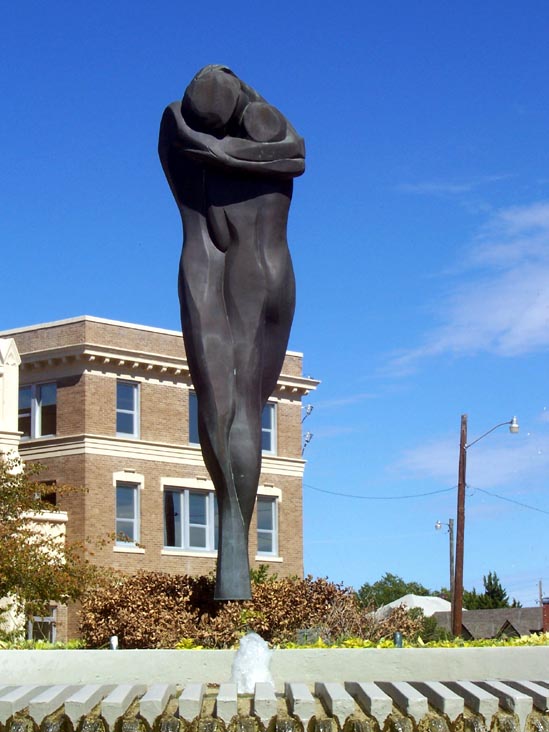
Identify the location of statue. The image size is (549, 732). (250, 285).